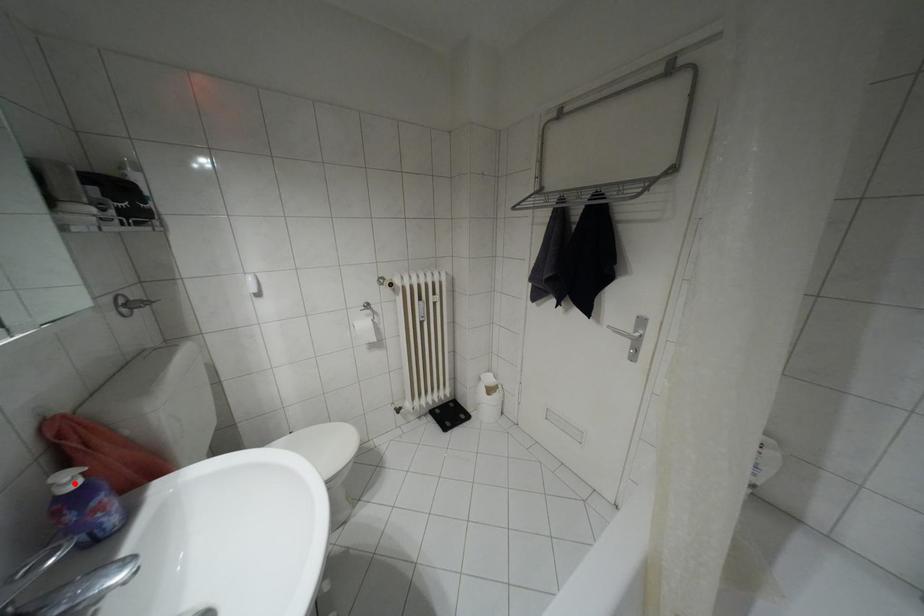
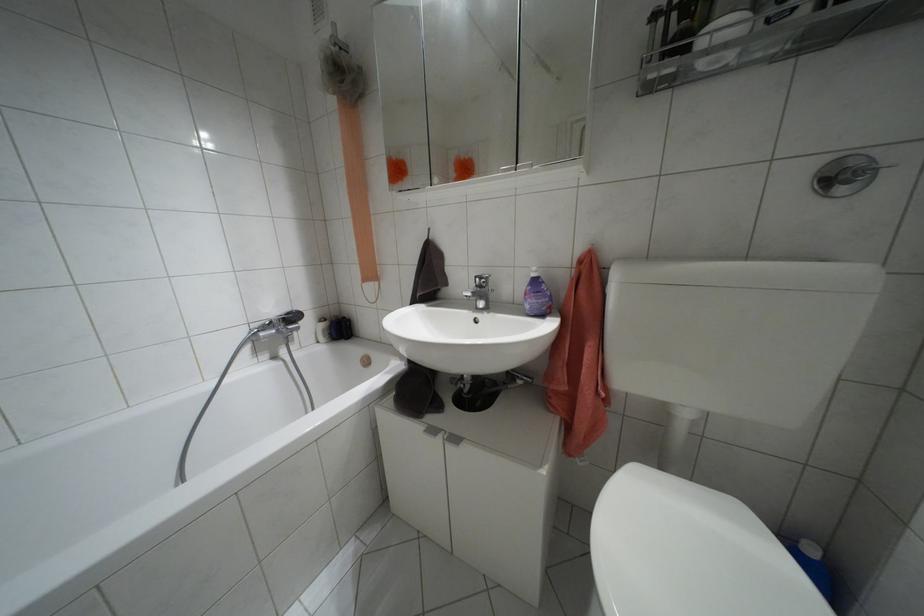
Locate, in the second image, the point that corresponds to the highlighted location in the first image.

(532, 274)